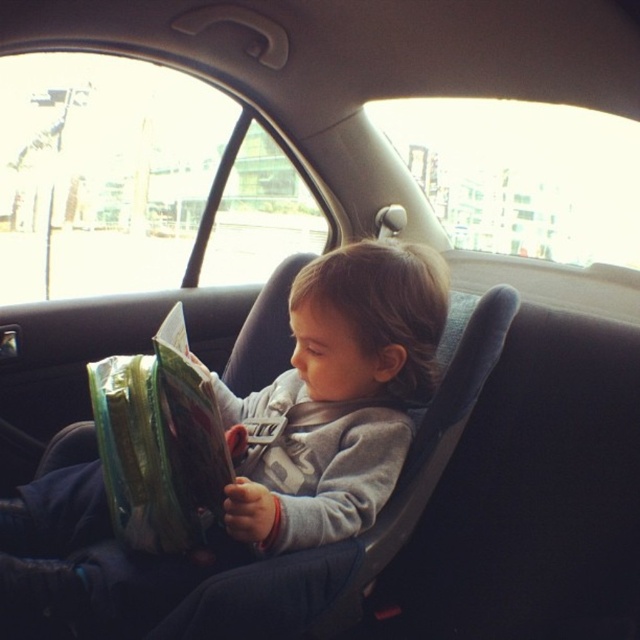
Between gray soft fabric toddler at center and green plastic bag at center, which one is positioned higher?

green plastic bag at center

Does gray soft fabric toddler at center appear on the right side of green plastic bag at center?

Correct, you'll find gray soft fabric toddler at center to the right of green plastic bag at center.

Find the location of a particular element. gray soft fabric toddler at center is located at coordinates (250, 456).